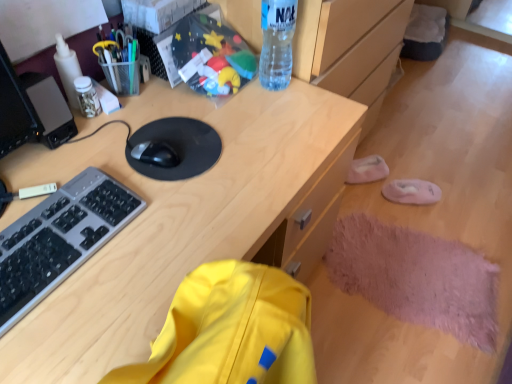
The width and height of the screenshot is (512, 384). Find the location of `free space between black matte mouse at center and white plastic bottle at upper left, which ranks as the first bottle in left-to-right order`. free space between black matte mouse at center and white plastic bottle at upper left, which ranks as the first bottle in left-to-right order is located at coordinates (122, 129).